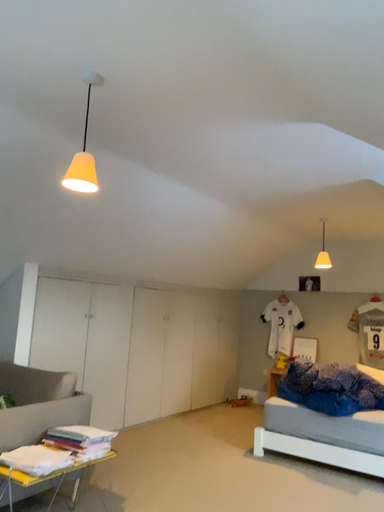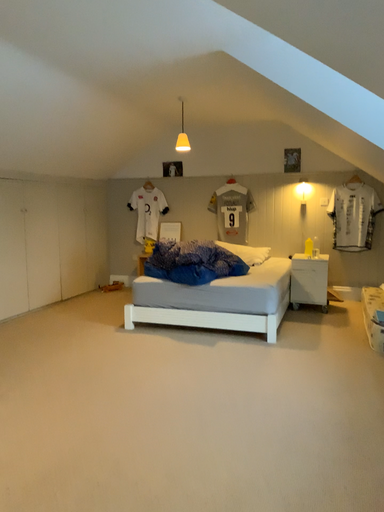
Question: Which way did the camera rotate in the video?

Choices:
 (A) rotated right
 (B) rotated left

Answer: (A)